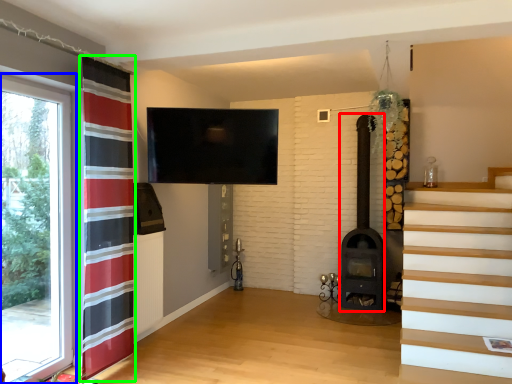
Question: Which object is the farthest from fireplace (highlighted by a red box)? Choose among these: window (highlighted by a blue box) or curtain (highlighted by a green box).

Choices:
 (A) window
 (B) curtain

Answer: (A)